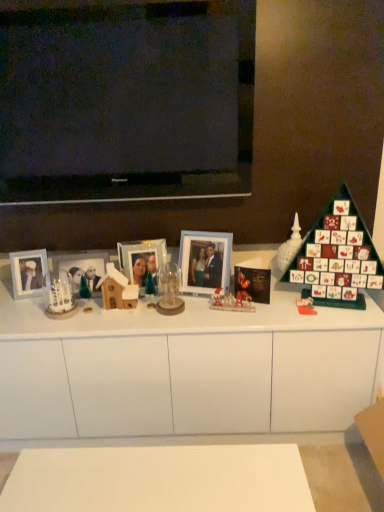
Question: From a real-world perspective, is matte glass photo frame at center, which is the 4th picture frame from left to right, positioned over green matte advent calendar at right based on gravity?

Choices:
 (A) yes
 (B) no

Answer: (B)

Question: Does matte glass photo frame at center, which is the 4th picture frame from left to right, have a greater width compared to green matte advent calendar at right?

Choices:
 (A) no
 (B) yes

Answer: (A)

Question: Is matte glass photo frame at center, the first picture frame in the right-to-left sequence, further to camera compared to green matte advent calendar at right?

Choices:
 (A) yes
 (B) no

Answer: (A)

Question: Considering the relative sizes of matte glass photo frame at center, the first picture frame in the right-to-left sequence, and green matte advent calendar at right in the image provided, is matte glass photo frame at center, the first picture frame in the right-to-left sequence, bigger than green matte advent calendar at right?

Choices:
 (A) no
 (B) yes

Answer: (A)

Question: Is matte glass photo frame at center, which is the 4th picture frame from left to right, in contact with green matte advent calendar at right?

Choices:
 (A) yes
 (B) no

Answer: (B)

Question: Would you say matte glass photo frame at center, the first picture frame in the right-to-left sequence, is outside green matte advent calendar at right?

Choices:
 (A) no
 (B) yes

Answer: (B)

Question: Can you confirm if green matte advent calendar at right is wider than white matte cabinet at center?

Choices:
 (A) yes
 (B) no

Answer: (B)

Question: Does green matte advent calendar at right have a smaller size compared to white matte cabinet at center?

Choices:
 (A) yes
 (B) no

Answer: (A)

Question: Is green matte advent calendar at right positioned in front of white matte cabinet at center?

Choices:
 (A) yes
 (B) no

Answer: (A)

Question: Is green matte advent calendar at right at the left side of white matte cabinet at center?

Choices:
 (A) yes
 (B) no

Answer: (B)

Question: Is green matte advent calendar at right taller than white matte cabinet at center?

Choices:
 (A) yes
 (B) no

Answer: (B)

Question: Is green matte advent calendar at right at the right side of white matte cabinet at center?

Choices:
 (A) no
 (B) yes

Answer: (B)

Question: Would you say white frosted glass candle holder at left contains white matte cabinet at center?

Choices:
 (A) no
 (B) yes

Answer: (A)